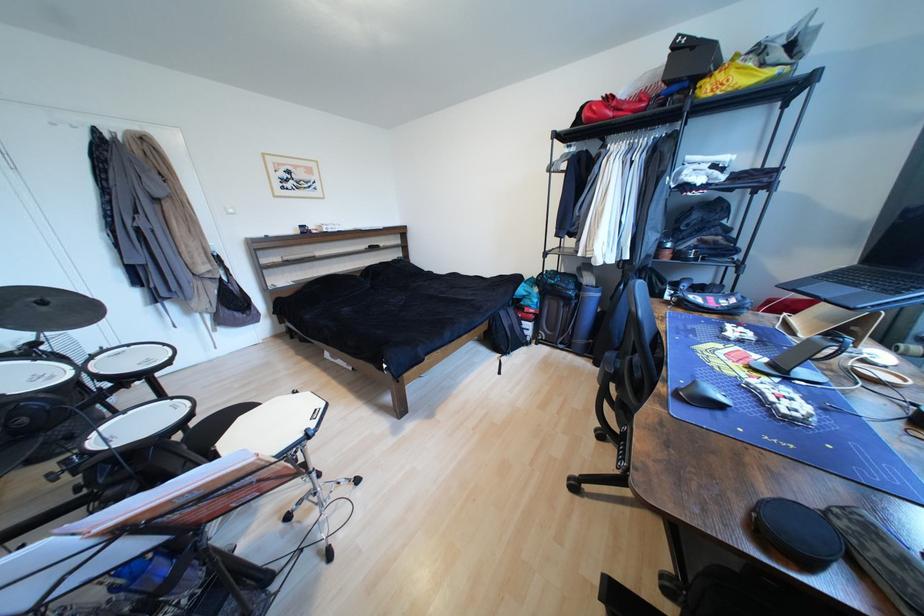
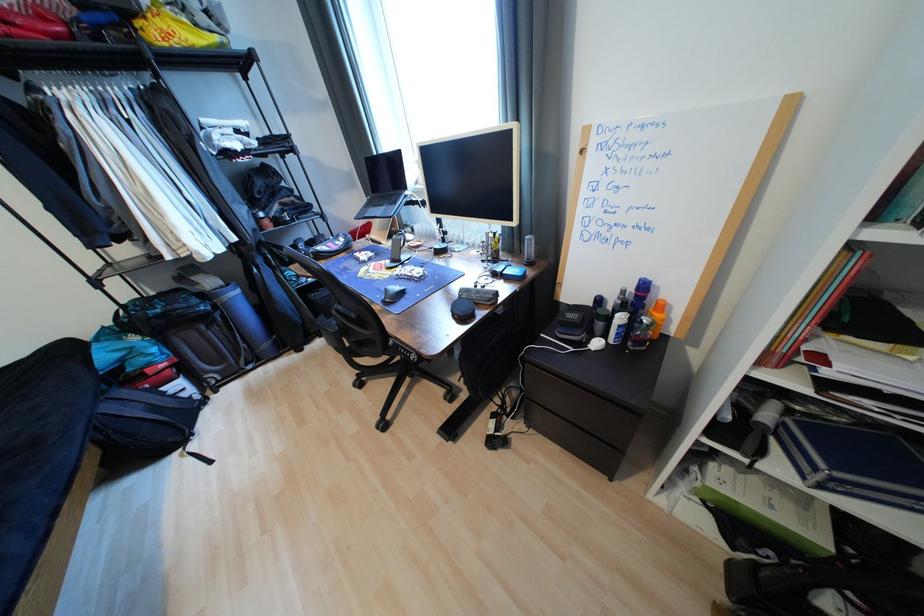
Find the pixel in the second image that matches (x=701, y=384) in the first image.

(393, 292)